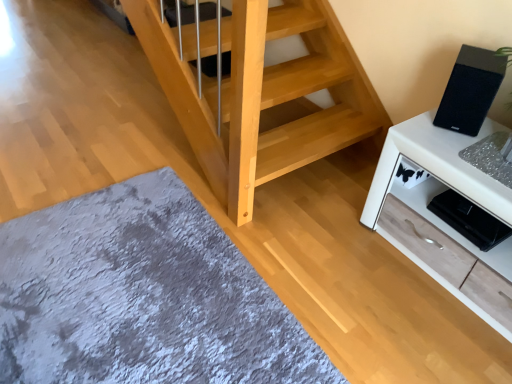
I want to click on vacant region above black matte speaker at upper right (from a real-world perspective), so click(x=477, y=62).